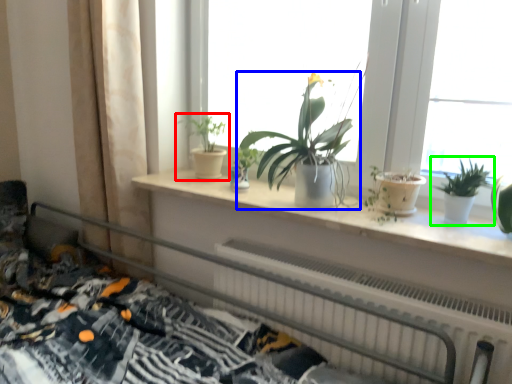
Question: Which object is positioned closest to houseplant (highlighted by a red box)? Select from houseplant (highlighted by a blue box) and houseplant (highlighted by a green box).

Choices:
 (A) houseplant
 (B) houseplant

Answer: (A)